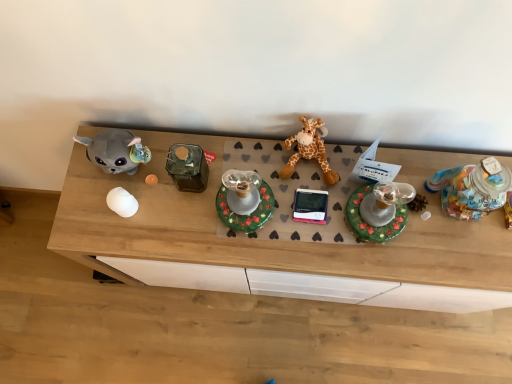
This screenshot has height=384, width=512. Identify the location of free space to the right of shiny green plastic candle holder at center, which is the 3th toy from left to right. (436, 233).